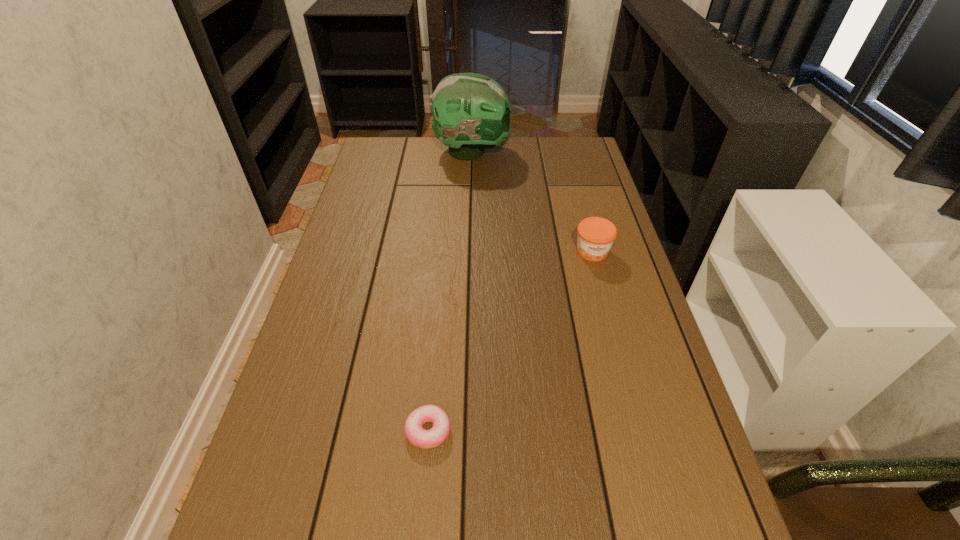
Identify the location of the tallest object. (471, 111).

Locate an element on the screen. Image resolution: width=960 pixels, height=540 pixels. football helmet is located at coordinates (471, 111).

Locate an element on the screen. The height and width of the screenshot is (540, 960). the second tallest object is located at coordinates (596, 235).

Where is `the rightmost object`? the rightmost object is located at coordinates [x=596, y=235].

Find the location of a particular element. the shortest object is located at coordinates (413, 427).

I want to click on doughnut, so click(x=413, y=427).

Image resolution: width=960 pixels, height=540 pixels. I want to click on free space located on the visor of the football helmet, so click(579, 152).

Identify the location of free region located 0.250m on the front label of the rightmost object. (615, 339).

Find the location of a particular element. This screenshot has height=540, width=960. vacant space located 0.300m on the right of the nearest object is located at coordinates (604, 430).

Identify the location of object that is at the far edge. (471, 111).